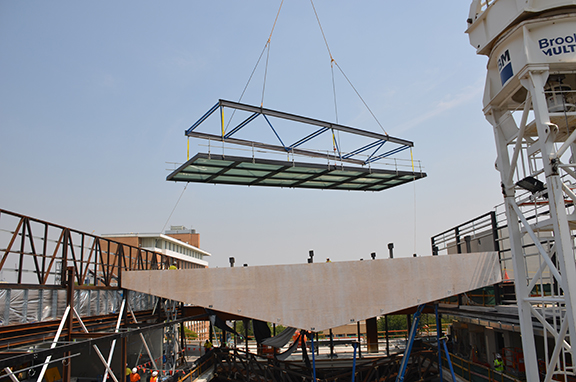
Find the location of a particular element. Image resolution: width=576 pixels, height=382 pixels. white windows is located at coordinates 173,249.